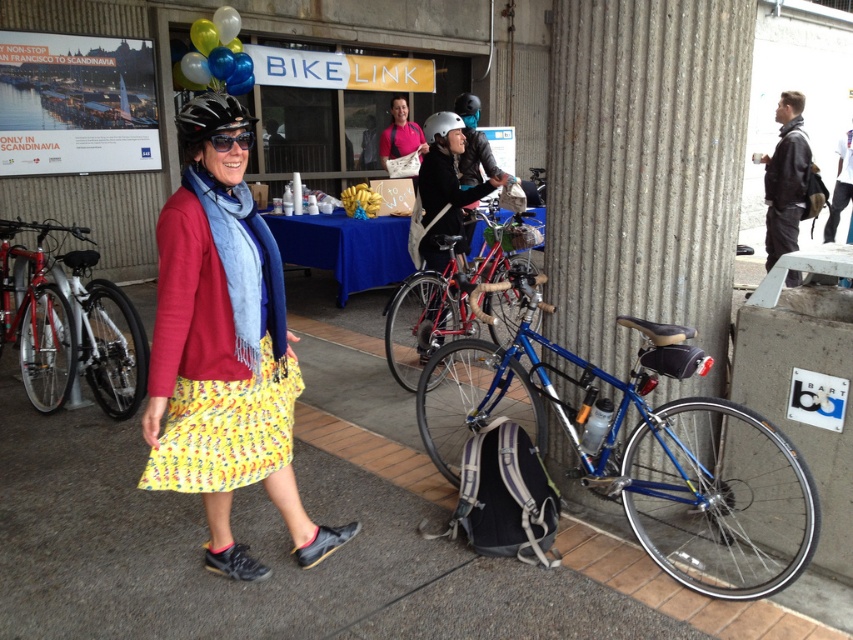
Between matte red sweater at center and pink fabric shirt at center, which one is positioned higher?

pink fabric shirt at center is higher up.

Is matte red sweater at center shorter than pink fabric shirt at center?

Result: No.

Who is more distant from viewer, [345,529] or [387,152]?

The point [387,152] is more distant.

Where is `matte red sweater at center`? matte red sweater at center is located at coordinates (224, 362).

Does blue metallic bicycle at lower right lie behind matte black helmet at upper left?

Yes, blue metallic bicycle at lower right is further from the viewer.

Is blue metallic bicycle at lower right above matte black helmet at upper left?

No, blue metallic bicycle at lower right is not above matte black helmet at upper left.

Which is behind, point (421, 374) or point (202, 116)?

Positioned behind is point (421, 374).

Find the location of a particular element. The image size is (853, 640). blue metallic bicycle at lower right is located at coordinates (645, 456).

Can you confirm if matte black helmet at upper left is taller than matte black sunglasses at center?

Yes.

Does point (206, 132) come in front of point (221, 138)?

Yes, point (206, 132) is closer to viewer.

Locate an element on the screen. The height and width of the screenshot is (640, 853). matte black helmet at upper left is located at coordinates (210, 116).